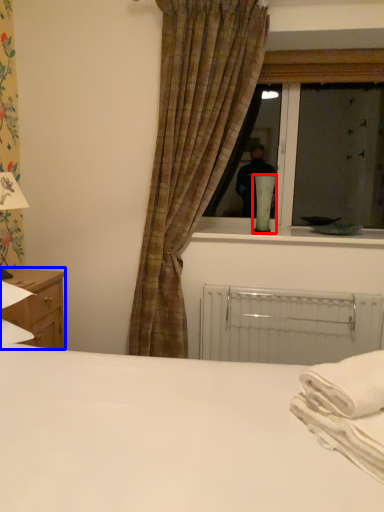
Question: Which object appears farthest to the camera in this image, table lamp (highlighted by a red box) or nightstand (highlighted by a blue box)?

Choices:
 (A) table lamp
 (B) nightstand

Answer: (A)